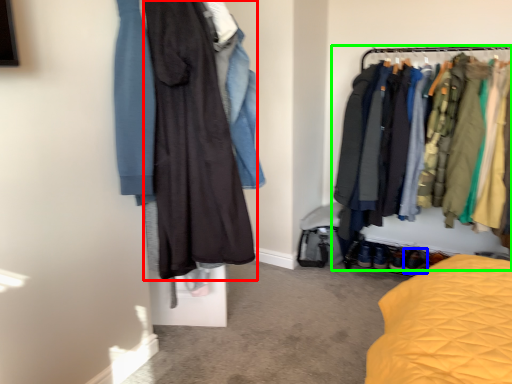
Question: Considering the real-world distances, which object is farthest from fancy dress (highlighted by a red box)? footwear (highlighted by a blue box) or closet (highlighted by a green box)?

Choices:
 (A) footwear
 (B) closet

Answer: (A)